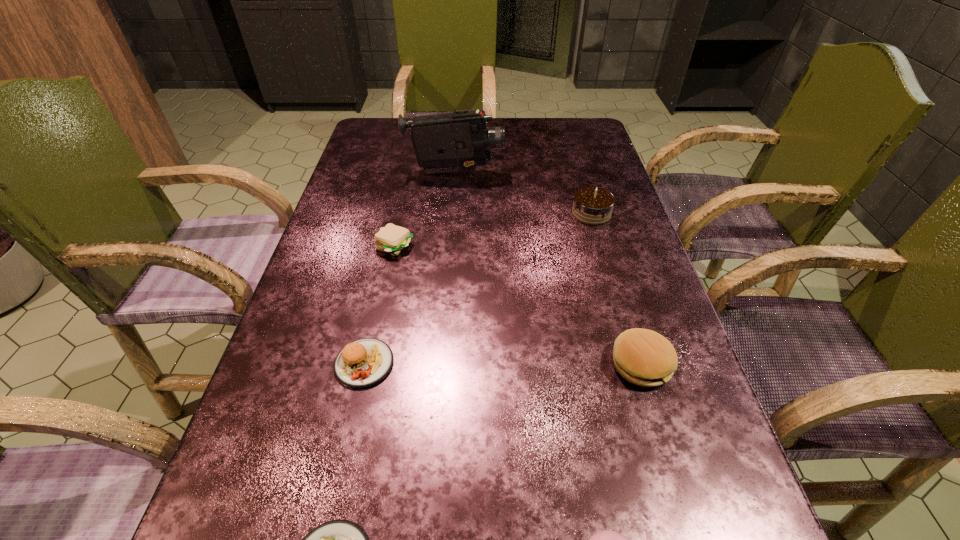
Where is `blank area located 0.390m on the right of the second shortest patty (food)`? The height and width of the screenshot is (540, 960). blank area located 0.390m on the right of the second shortest patty (food) is located at coordinates (586, 247).

Where is `camcorder located in the left edge section of the desktop`? The image size is (960, 540). camcorder located in the left edge section of the desktop is located at coordinates (450, 142).

Image resolution: width=960 pixels, height=540 pixels. I want to click on chocolate cake located at the right edge, so click(x=592, y=205).

You are a GUI agent. You are given a task and a screenshot of the screen. Output one action in this format:
    pyautogui.click(x=<x>, y=<y>)
    Task: Click on the patty present at the right edge
    This screenshot has height=540, width=960.
    Given the screenshot: What is the action you would take?
    pyautogui.click(x=643, y=357)

Locate an element on the screen. free space at the far edge of the desktop is located at coordinates (516, 135).

The image size is (960, 540). I want to click on vacant space at the left edge of the desktop, so click(x=276, y=515).

Identify the location of free space at the right edge. This screenshot has width=960, height=540. (624, 220).

Where is `vacant space at the far left corner of the desktop`? This screenshot has width=960, height=540. vacant space at the far left corner of the desktop is located at coordinates (413, 145).

You are a GUI agent. You are given a task and a screenshot of the screen. Output one action in this format:
    pyautogui.click(x=<x>, y=<y>)
    Task: Click on the vacant region at the far right corner of the desktop
    This screenshot has height=540, width=960.
    Given the screenshot: What is the action you would take?
    pyautogui.click(x=579, y=125)

Identify the location of free space between the fifth tallest object and the rightmost patty (food). Image resolution: width=960 pixels, height=540 pixels. (517, 305).